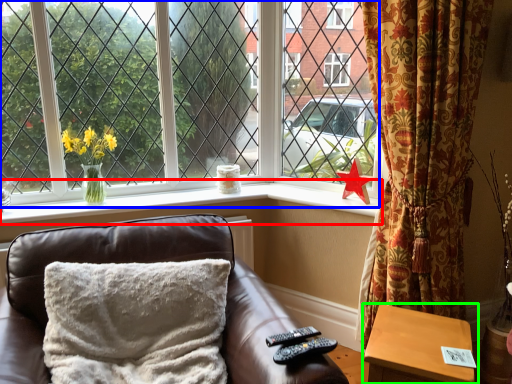
Question: Based on their relative distances, which object is nearer to window sill (highlighted by a red box)? Choose from window (highlighted by a blue box) and table (highlighted by a green box).

Choices:
 (A) window
 (B) table

Answer: (A)